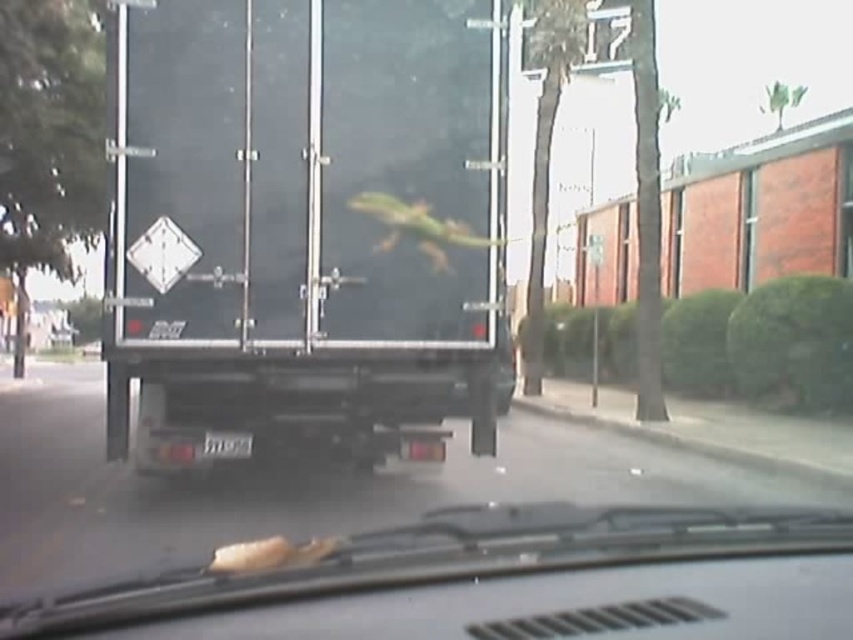
Does black matte trailer truck at center have a greater height compared to metallic gray car at center?

Correct, black matte trailer truck at center is much taller as metallic gray car at center.

Who is lower down, black matte trailer truck at center or metallic gray car at center?

metallic gray car at center

Locate an element on the screen. black matte trailer truck at center is located at coordinates (306, 227).

The image size is (853, 640). Identify the location of black matte trailer truck at center. (306, 227).